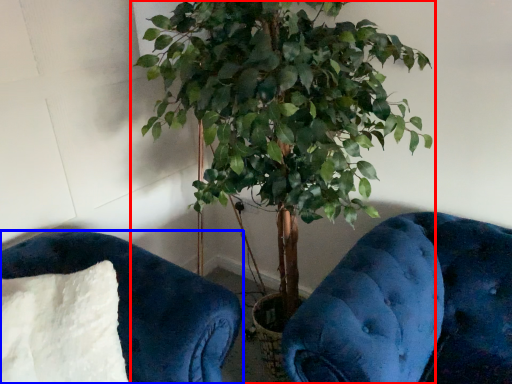
Question: Which point is further to the camera, houseplant (highlighted by a red box) or furniture (highlighted by a blue box)?

Choices:
 (A) houseplant
 (B) furniture

Answer: (B)